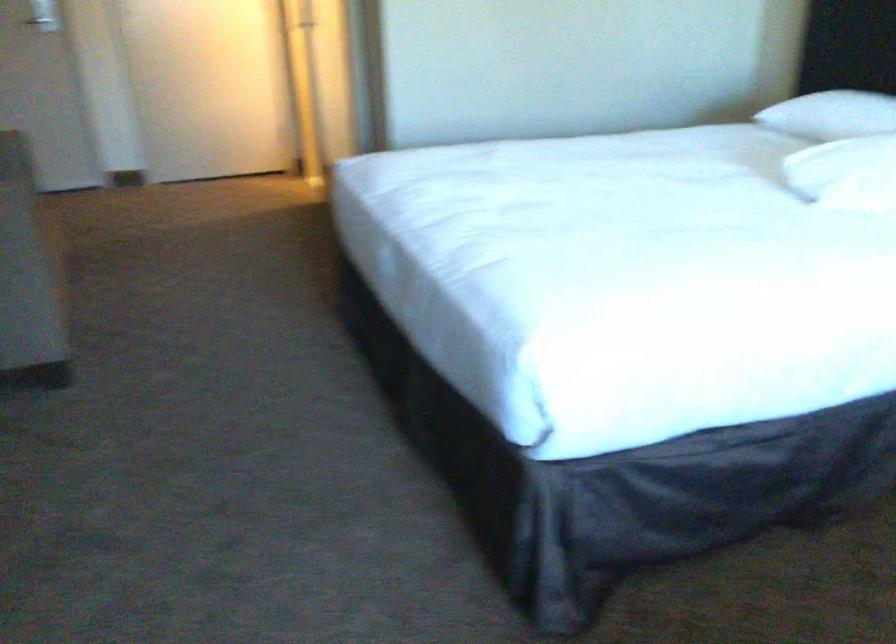
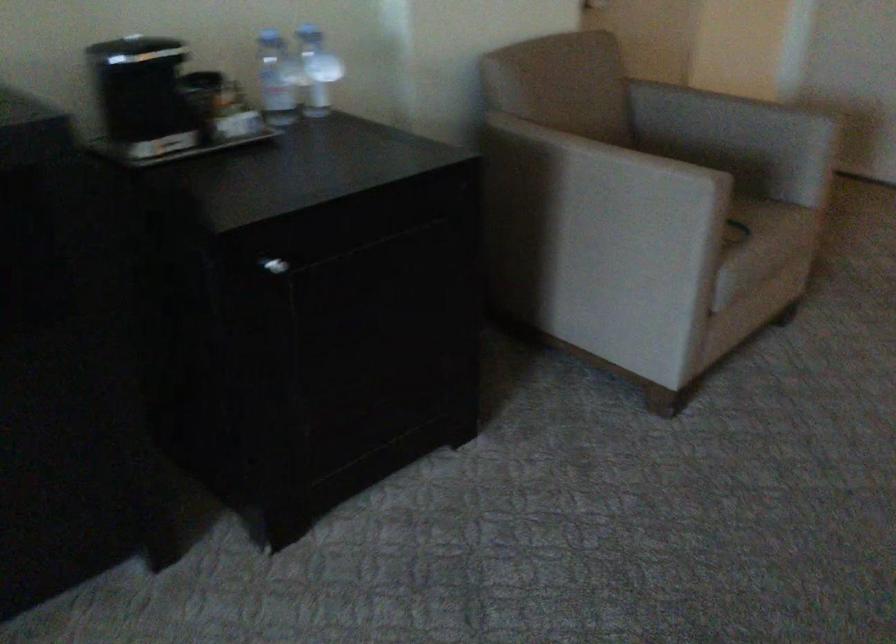
Looking at this image, based on the continuous images, in which direction is the camera rotating?

The camera rotated toward left-down.